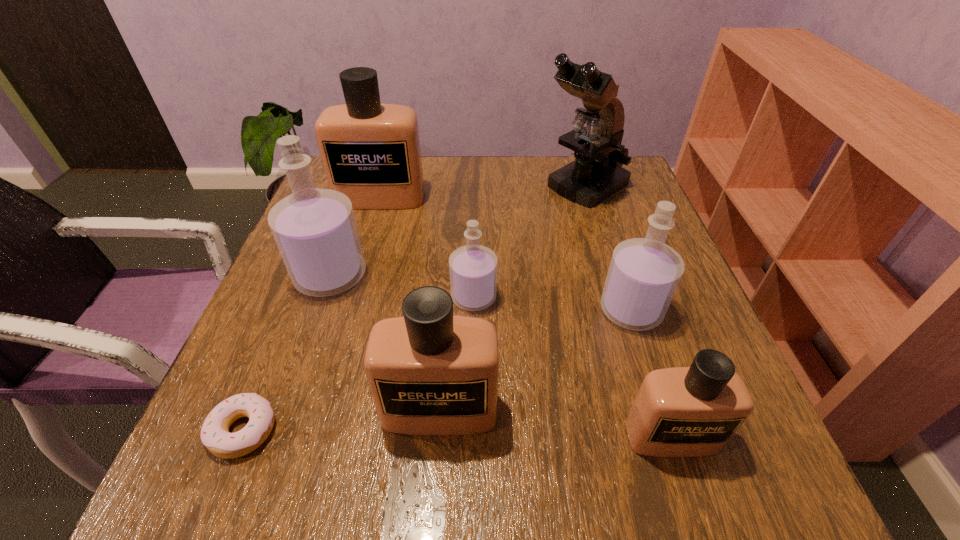
I want to click on microscope, so tap(597, 173).

In order to click on the farthest beige perfume in this screenshot , I will do `click(370, 151)`.

Where is `the biggest beige perfume`? Image resolution: width=960 pixels, height=540 pixels. the biggest beige perfume is located at coordinates (370, 151).

Locate an element on the screen. The image size is (960, 540). the biggest purple perfume is located at coordinates (315, 230).

Identify the location of the rightmost purple perfume. (644, 273).

This screenshot has width=960, height=540. Find the location of `the second smallest beige perfume`. the second smallest beige perfume is located at coordinates (430, 373).

Image resolution: width=960 pixels, height=540 pixels. I want to click on the second purple perfume from right to left, so click(473, 268).

Where is `the rightmost beige perfume`? the rightmost beige perfume is located at coordinates click(x=694, y=411).

You are a GUI agent. You are given a task and a screenshot of the screen. Output one action in this format:
    pyautogui.click(x=<x>, y=<y>)
    Task: Click on the white doughnut
    The height and width of the screenshot is (540, 960).
    Given the screenshot: What is the action you would take?
    pyautogui.click(x=215, y=435)

Find the location of a particular element. The width and height of the screenshot is (960, 540). doughnut is located at coordinates (215, 435).